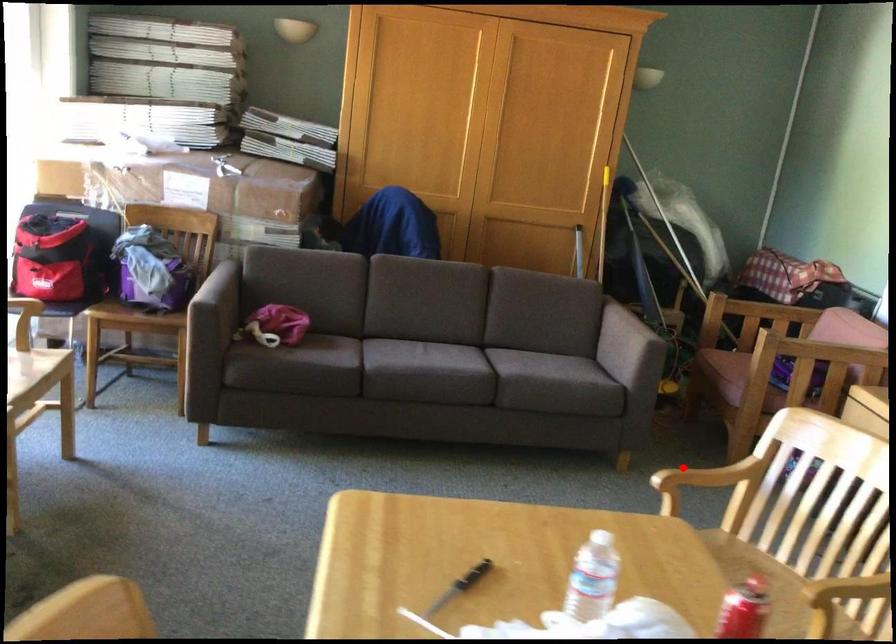
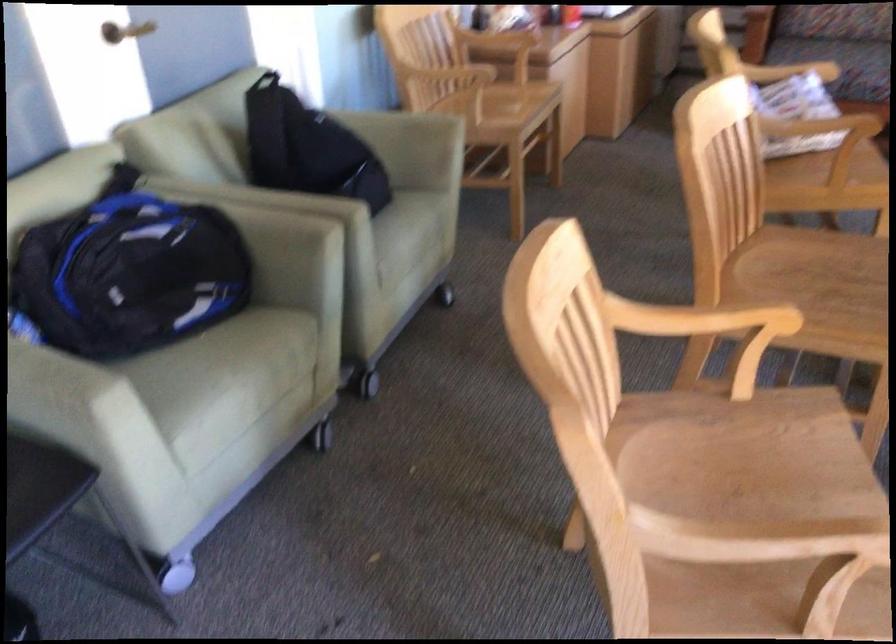
Where in the second image is the point corresponding to the highlighted location from the first image?

(760, 538)